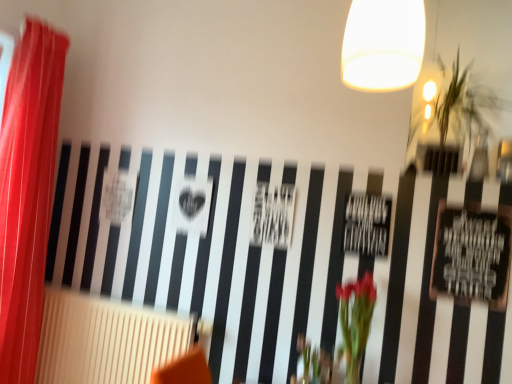
Question: Considering the relative positions of red sheer curtain at left and green leafy vase at center in the image provided, is red sheer curtain at left to the left or to the right of green leafy vase at center?

Choices:
 (A) left
 (B) right

Answer: (A)

Question: Considering the positions of red sheer curtain at left and green leafy vase at center in the image, is red sheer curtain at left wider or thinner than green leafy vase at center?

Choices:
 (A) wide
 (B) thin

Answer: (A)

Question: Which of these objects is positioned closest to the red sheer curtain at left?

Choices:
 (A) green leafy plant at upper right
 (B) beige textured radiator at lower left
 (C) green leafy vase at center

Answer: (B)

Question: Based on their relative distances, which object is nearer to the red sheer curtain at left?

Choices:
 (A) beige textured radiator at lower left
 (B) green leafy plant at upper right
 (C) green leafy vase at center

Answer: (A)